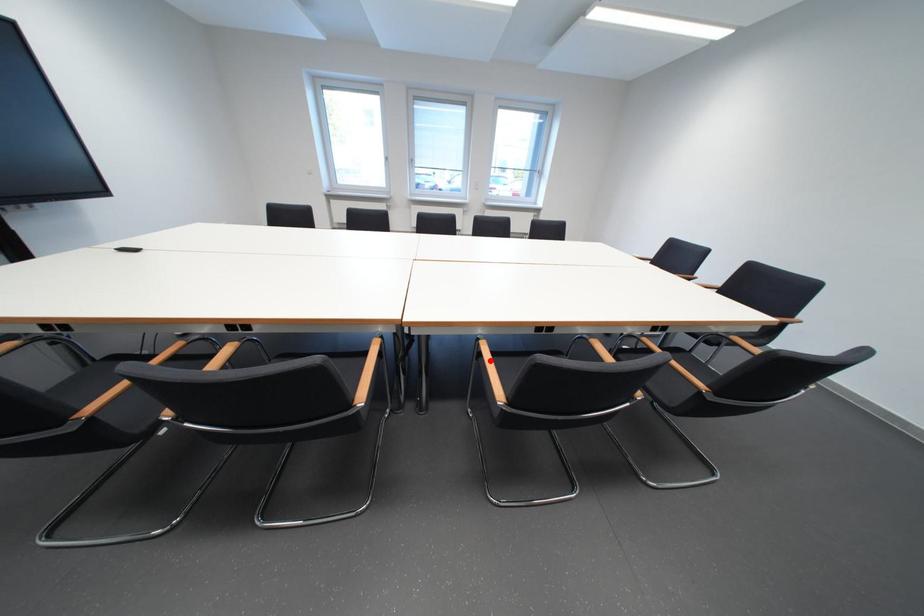
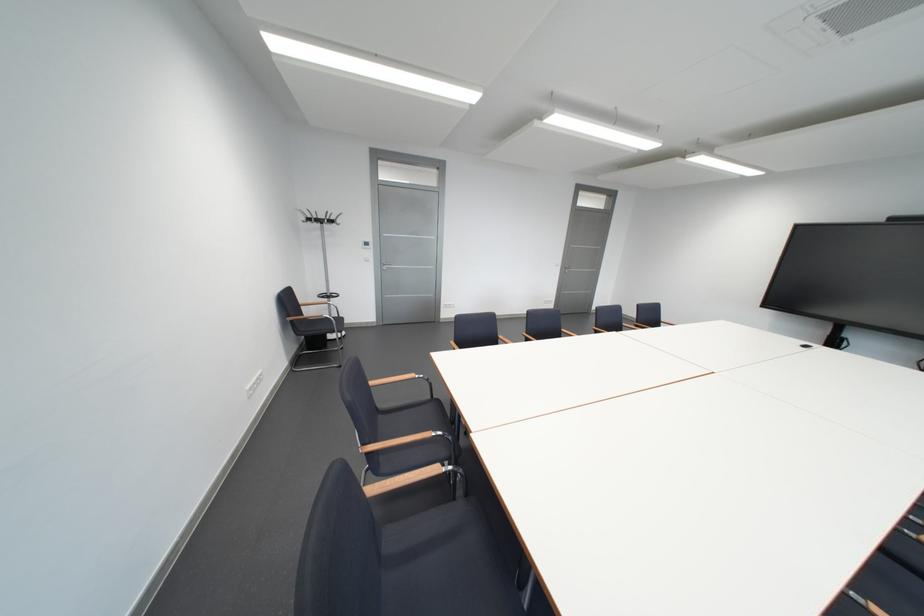
Question: I am providing you with two images of the same scene from different viewpoints. A red point is marked on the first image. Can you still see the location of the red point in image 2?

Choices:
 (A) Yes
 (B) No

Answer: (B)